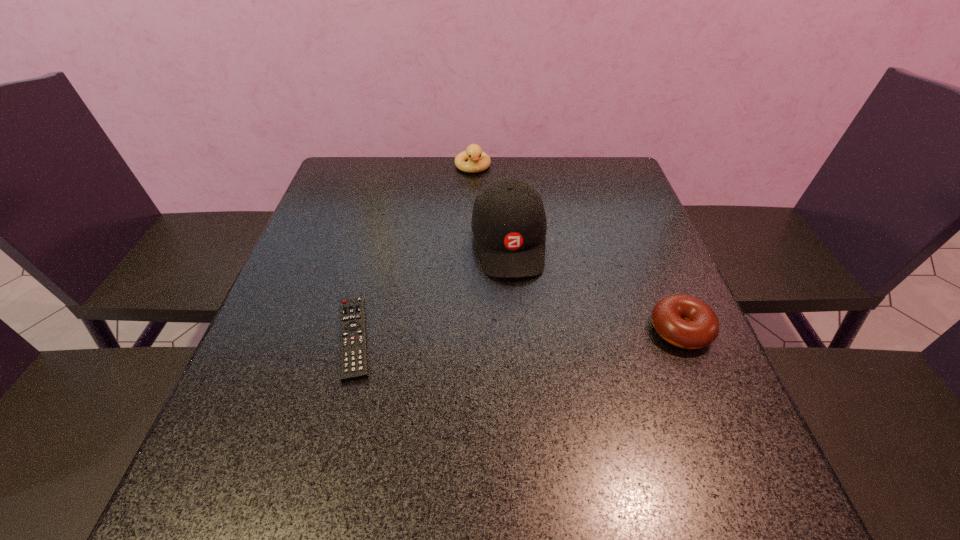
The image size is (960, 540). I want to click on free point at the near edge, so click(499, 404).

In the image, there is a desktop. Find the location of `free space at the left edge`. free space at the left edge is located at coordinates tap(308, 222).

Identify the location of vacant space at the right edge. (612, 231).

In the image, there is a desktop. Identify the location of vacant space at the far left corner. (350, 172).

Where is `vacant region at the near left corner of the desktop`? vacant region at the near left corner of the desktop is located at coordinates (233, 413).

In the image, there is a desktop. Where is `free region at the far right corner`? This screenshot has width=960, height=540. free region at the far right corner is located at coordinates (600, 171).

I want to click on empty location between the second farthest object and the rightmost object, so click(594, 286).

At what (x,y) coordinates should I click in order to perform the action: click on free space between the remote control and the third nearest object. Please return your answer as a coordinate pair (x, y). This screenshot has width=960, height=540. Looking at the image, I should click on (431, 291).

What are the coordinates of `vacant region between the farthest object and the second shortest object` in the screenshot? It's located at (577, 248).

The width and height of the screenshot is (960, 540). I want to click on vacant space that's between the doughnut and the tallest object, so click(594, 286).